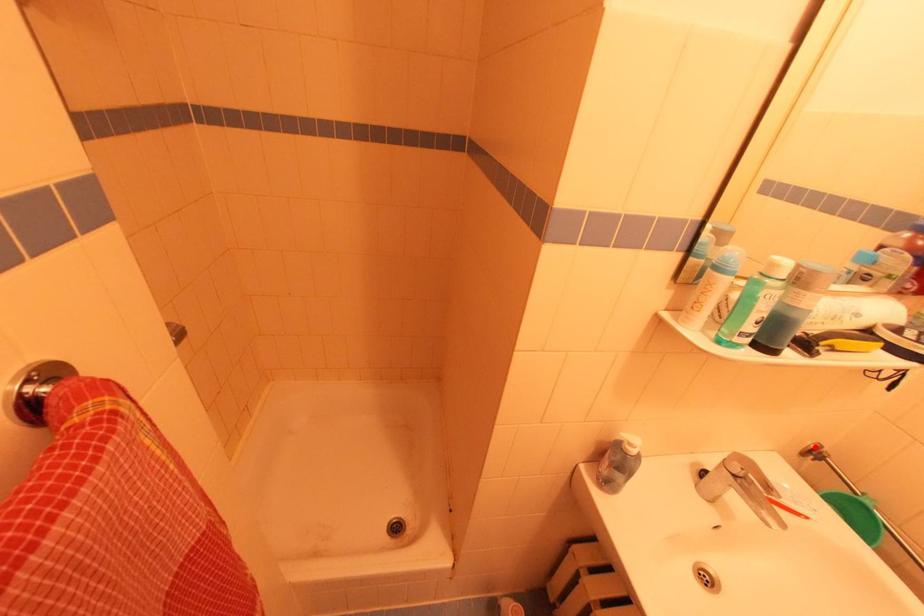
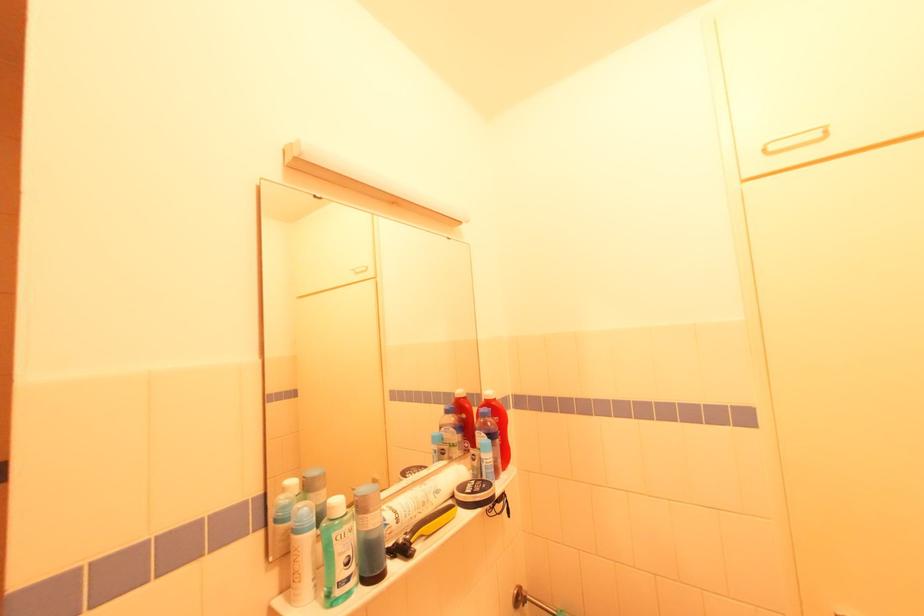
Question: I am providing you with two images of the same scene from different viewpoints. A red point is marked on the first image. Can you still see the location of the red point in image 2?

Choices:
 (A) Yes
 (B) No

Answer: (A)